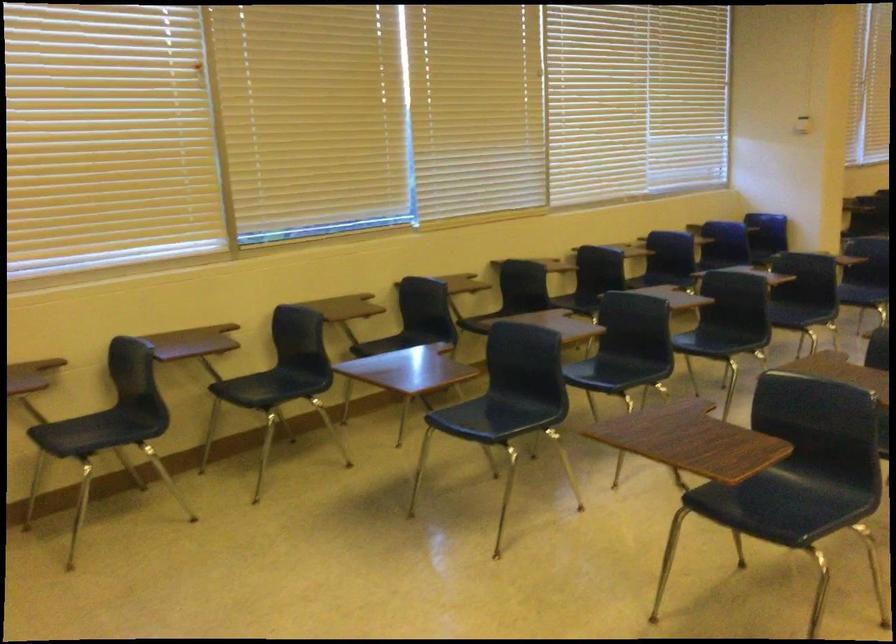
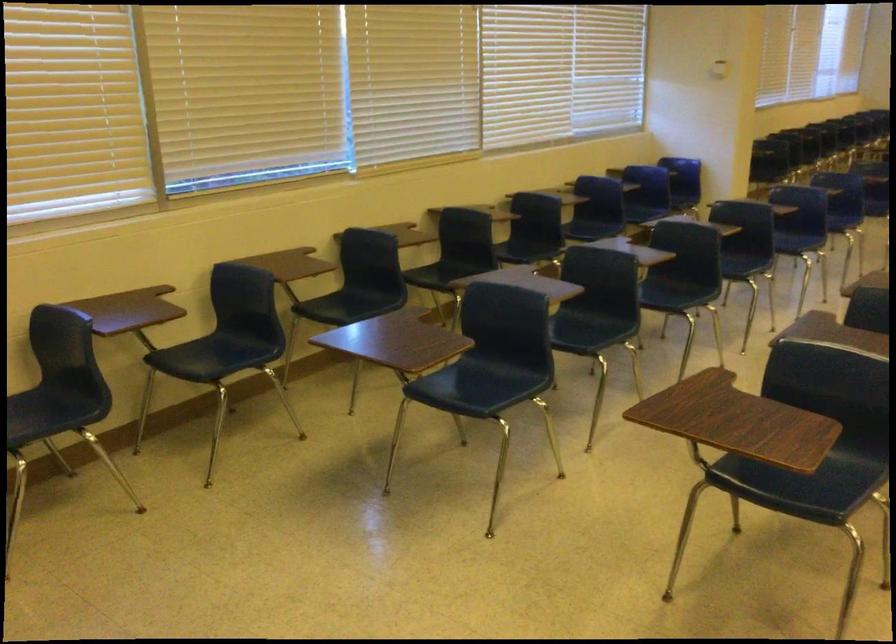
In the second image, find the point that corresponds to (x=252, y=389) in the first image.

(196, 359)